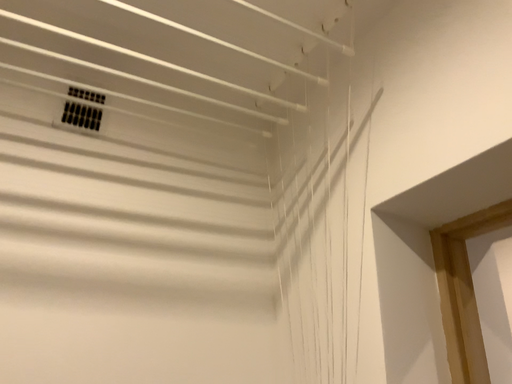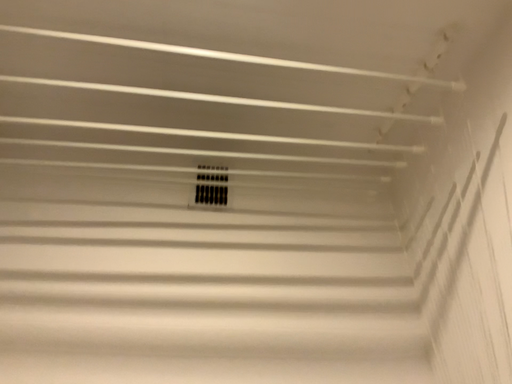
Question: How did the camera likely rotate when shooting the video?

Choices:
 (A) rotated right
 (B) rotated left

Answer: (B)